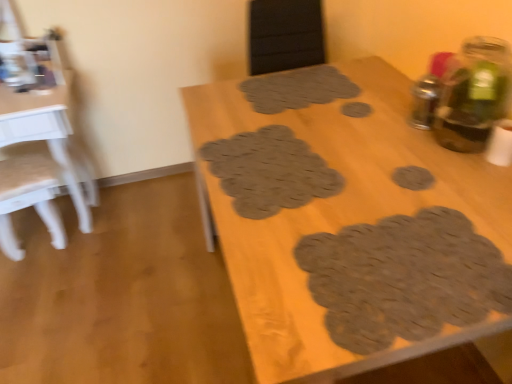
The height and width of the screenshot is (384, 512). I want to click on vacant space situated above brown textured placemats at center, which is the 1th table from right to left (from a real-world perspective), so click(x=344, y=159).